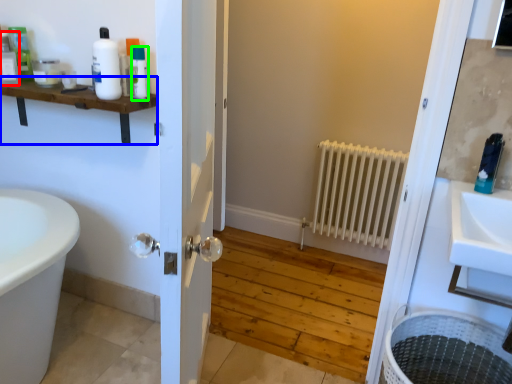
Question: Estimate the real-world distances between objects in this image. Which object is closer to toiletry (highlighted by a red box), balustrade (highlighted by a blue box) or toiletry (highlighted by a green box)?

Choices:
 (A) balustrade
 (B) toiletry

Answer: (A)